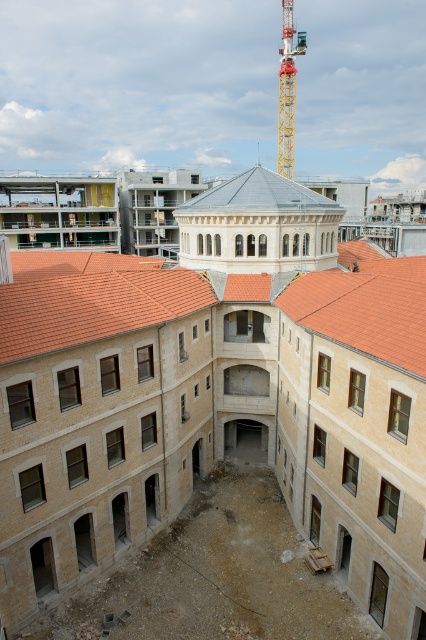
You are an architect inspecting the construction site. You need to determine if the beige stone construction site at center is wider than the orange tile roof at center. Based on the scene, can you confirm this?

The beige stone construction site at center is wider than the orange tile roof at center according to the description.

You are standing at point A located at coordinates point A at (x=365, y=520). You need to walk to point B, which is 22.76 meters away. Can you estimate how long it would take you to walk that distance at a normal walking speed of 1.4 meters per second?

At a normal walking speed of 1.4 meters per second, it would take approximately 16.26 seconds to cover the 22.76 meters between point A at (x=365, y=520) and point B. The calculation is 22.76 divided by 1.4, which equals roughly 16.26 seconds.

You are standing in the courtyard of the partially constructed building complex. There are two points marked in the image, one at coordinates point (5, 577) and another at point (250, 188). Which point is nearer to your current position?

Point (5, 577) is closer to the viewer than point (250, 188), so the point at coordinates point (5, 577) is nearer to your current position.